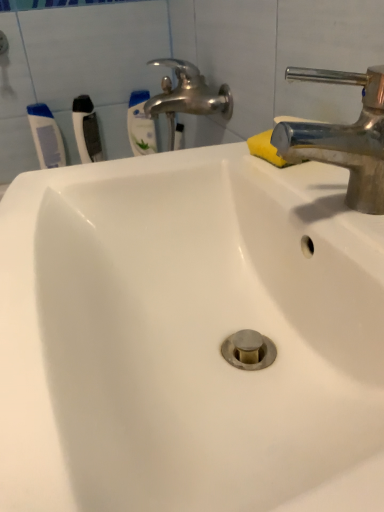
Question: Is white plastic toothbrush at upper left, acting as the second toothbrush starting from the right, in contact with yellow sponge at upper right?

Choices:
 (A) yes
 (B) no

Answer: (B)

Question: Considering the relative sizes of white plastic toothbrush at upper left, acting as the second toothbrush starting from the right, and yellow sponge at upper right in the image provided, is white plastic toothbrush at upper left, acting as the second toothbrush starting from the right, wider than yellow sponge at upper right?

Choices:
 (A) yes
 (B) no

Answer: (B)

Question: From a real-world perspective, is white plastic toothbrush at upper left, the second toothbrush from the left, located higher than yellow sponge at upper right?

Choices:
 (A) yes
 (B) no

Answer: (B)

Question: Is white plastic toothbrush at upper left, acting as the second toothbrush starting from the right, positioned with its back to yellow sponge at upper right?

Choices:
 (A) no
 (B) yes

Answer: (A)

Question: From the image's perspective, would you say white plastic toothbrush at upper left, acting as the second toothbrush starting from the right, is positioned over yellow sponge at upper right?

Choices:
 (A) yes
 (B) no

Answer: (A)

Question: Considering the relative sizes of white plastic toothbrush at upper left, acting as the second toothbrush starting from the right, and yellow sponge at upper right in the image provided, is white plastic toothbrush at upper left, acting as the second toothbrush starting from the right, thinner than yellow sponge at upper right?

Choices:
 (A) no
 (B) yes

Answer: (B)

Question: From a real-world perspective, is white plastic toothbrush at upper left, acting as the first toothbrush starting from the left, over yellow sponge at upper right?

Choices:
 (A) no
 (B) yes

Answer: (A)

Question: Considering the relative sizes of white plastic toothbrush at upper left, which is the third toothbrush in right-to-left order, and yellow sponge at upper right in the image provided, is white plastic toothbrush at upper left, which is the third toothbrush in right-to-left order, wider than yellow sponge at upper right?

Choices:
 (A) no
 (B) yes

Answer: (A)

Question: Is white plastic toothbrush at upper left, which is the third toothbrush in right-to-left order, not within yellow sponge at upper right?

Choices:
 (A) yes
 (B) no

Answer: (A)

Question: From the image's perspective, is white plastic toothbrush at upper left, which is the third toothbrush in right-to-left order, on yellow sponge at upper right?

Choices:
 (A) no
 (B) yes

Answer: (B)

Question: Considering the relative positions of white plastic toothbrush at upper left, acting as the first toothbrush starting from the left, and yellow sponge at upper right in the image provided, is white plastic toothbrush at upper left, acting as the first toothbrush starting from the left, behind yellow sponge at upper right?

Choices:
 (A) no
 (B) yes

Answer: (B)

Question: Is white plastic toothbrush at upper left, which is the third toothbrush in right-to-left order, surrounded by white plastic toothbrush at upper left, acting as the second toothbrush starting from the right?

Choices:
 (A) no
 (B) yes

Answer: (A)